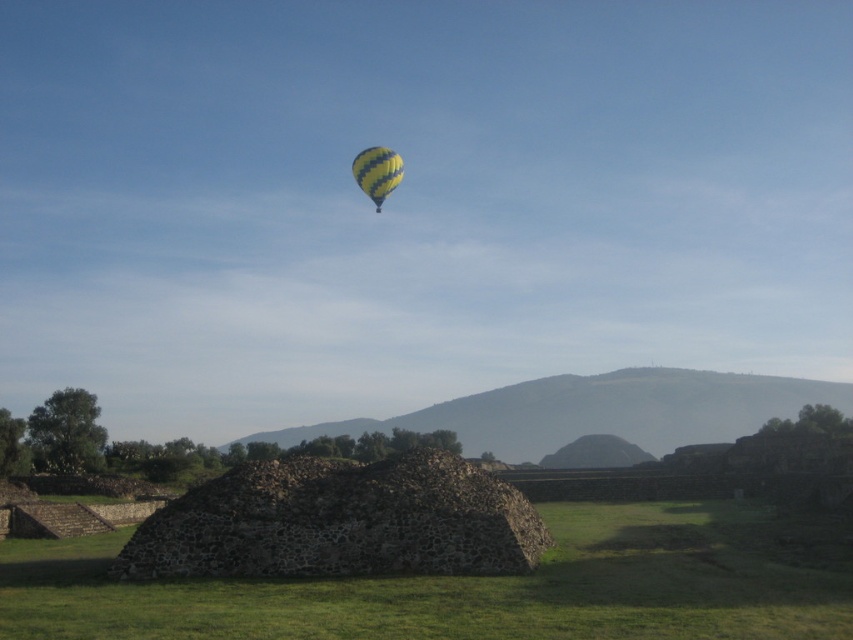
Question: Is the position of dark gray stone pyramid at center less distant than that of yellow striped balloon at upper center?

Choices:
 (A) yes
 (B) no

Answer: (A)

Question: Observing the image, what is the correct spatial positioning of dark gray stone pyramid at center in reference to yellow striped balloon at upper center?

Choices:
 (A) left
 (B) right

Answer: (B)

Question: Is dark gray stone pyramid at center thinner than yellow striped balloon at upper center?

Choices:
 (A) yes
 (B) no

Answer: (B)

Question: Which of the following is the farthest from the observer?

Choices:
 (A) pos(399,173)
 (B) pos(123,628)

Answer: (A)

Question: Which point appears closest to the camera in this image?

Choices:
 (A) (231, 637)
 (B) (381, 198)

Answer: (A)